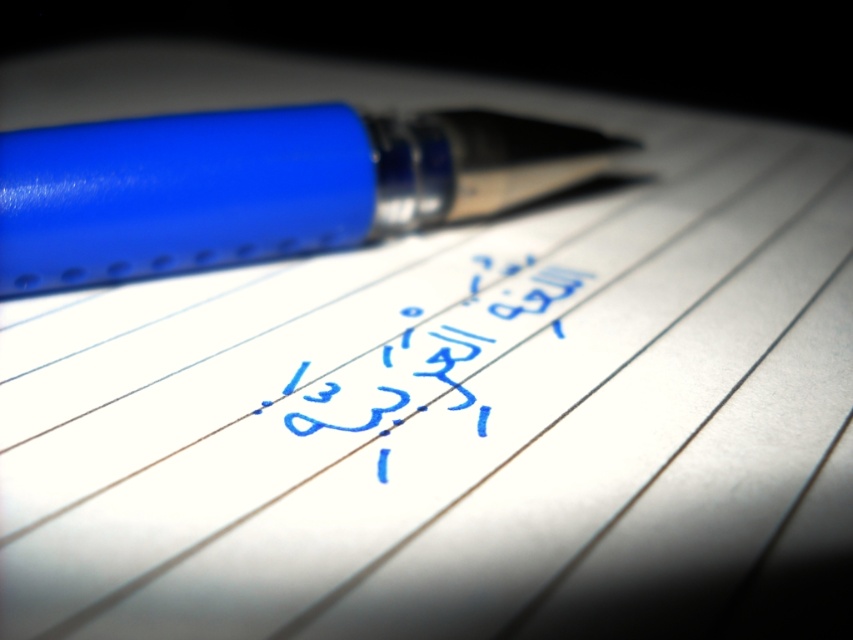
You are trying to write a note using the matte blue pen at upper left. However, you notice the blue ink writing at center on the page. Which object is closer to you, the pen or the writing?

The matte blue pen at upper left is closer to you than the blue ink writing at center.

You are an office worker who needs to sign a document. You have a matte blue pen at upper left and blue ink writing at center. Which object is taller and can be used to ensure your signature stands out more?

The matte blue pen at upper left is taller than the blue ink writing at center, so using the matte blue pen at upper left would make the signature stand out more due to its greater height.